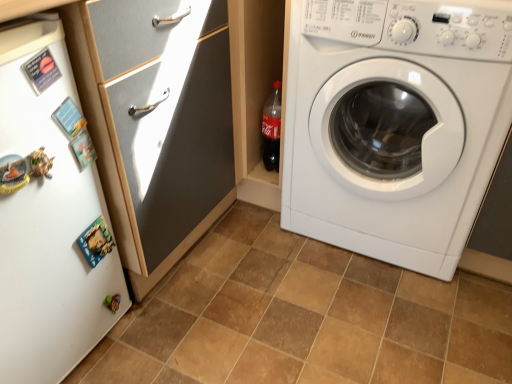
Question: Does white glossy washing machine at right have a lesser width compared to brown matte tile at center?

Choices:
 (A) no
 (B) yes

Answer: (B)

Question: Are white glossy washing machine at right and brown matte tile at center located far from each other?

Choices:
 (A) yes
 (B) no

Answer: (B)

Question: Is white glossy washing machine at right to the left of brown matte tile at center from the viewer's perspective?

Choices:
 (A) no
 (B) yes

Answer: (A)

Question: From a real-world perspective, is white glossy washing machine at right located beneath brown matte tile at center?

Choices:
 (A) yes
 (B) no

Answer: (B)

Question: Is white glossy washing machine at right located outside brown matte tile at center?

Choices:
 (A) yes
 (B) no

Answer: (A)

Question: Visually, is white glossy cabinet at upper left positioned to the left or to the right of brown matte tile at center?

Choices:
 (A) right
 (B) left

Answer: (B)

Question: From the image's perspective, is white glossy cabinet at upper left located above or below brown matte tile at center?

Choices:
 (A) above
 (B) below

Answer: (A)

Question: Is point (138, 99) positioned closer to the camera than point (350, 375)?

Choices:
 (A) closer
 (B) farther

Answer: (A)

Question: From their relative heights in the image, would you say white glossy cabinet at upper left is taller or shorter than brown matte tile at center?

Choices:
 (A) tall
 (B) short

Answer: (A)

Question: From a real-world perspective, is white matte refrigerator at left positioned above or below brown matte tile at center?

Choices:
 (A) above
 (B) below

Answer: (A)

Question: Looking at their shapes, would you say white matte refrigerator at left is wider or thinner than brown matte tile at center?

Choices:
 (A) wide
 (B) thin

Answer: (B)

Question: Is white matte refrigerator at left inside the boundaries of brown matte tile at center, or outside?

Choices:
 (A) outside
 (B) inside

Answer: (A)

Question: Relative to brown matte tile at center, is white matte refrigerator at left in front or behind?

Choices:
 (A) behind
 (B) front

Answer: (B)

Question: From a real-world perspective, relative to white glossy washing machine at right, is white glossy cabinet at upper left vertically above or below?

Choices:
 (A) below
 (B) above

Answer: (B)

Question: Is white glossy cabinet at upper left in front of or behind white glossy washing machine at right in the image?

Choices:
 (A) front
 (B) behind

Answer: (A)